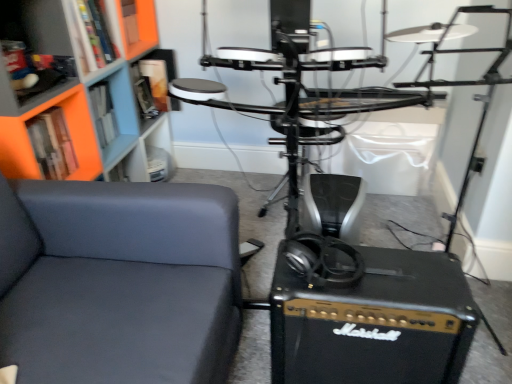
Question: Can you confirm if matte gray chair at left is thinner than orange matte bookshelf at upper left, which ranks as the 1th shelf in top-to-bottom order?

Choices:
 (A) no
 (B) yes

Answer: (A)

Question: Considering the relative sizes of matte gray chair at left and orange matte bookshelf at upper left, which ranks as the 1th shelf in top-to-bottom order, in the image provided, is matte gray chair at left smaller than orange matte bookshelf at upper left, which ranks as the 1th shelf in top-to-bottom order,?

Choices:
 (A) yes
 (B) no

Answer: (B)

Question: Is matte gray chair at left positioned behind orange matte bookshelf at upper left, which is the third shelf from bottom to top?

Choices:
 (A) yes
 (B) no

Answer: (B)

Question: From the image's perspective, is matte gray chair at left under orange matte bookshelf at upper left, which is the third shelf from bottom to top?

Choices:
 (A) yes
 (B) no

Answer: (A)

Question: Can you confirm if matte gray chair at left is bigger than orange matte bookshelf at upper left, which ranks as the 1th shelf in top-to-bottom order?

Choices:
 (A) no
 (B) yes

Answer: (B)

Question: Is matte gray chair at left wider than orange matte bookshelf at upper left, which ranks as the 1th shelf in top-to-bottom order?

Choices:
 (A) yes
 (B) no

Answer: (A)

Question: Does orange matte bookshelf at upper left, which is the third shelf from bottom to top, turn towards matte gray chair at left?

Choices:
 (A) no
 (B) yes

Answer: (A)

Question: Is the position of orange matte bookshelf at upper left, which ranks as the 1th shelf in top-to-bottom order, less distant than that of matte gray chair at left?

Choices:
 (A) no
 (B) yes

Answer: (A)

Question: Is orange matte bookshelf at upper left, which ranks as the 1th shelf in top-to-bottom order, looking in the opposite direction of matte gray chair at left?

Choices:
 (A) yes
 (B) no

Answer: (B)

Question: Does orange matte bookshelf at upper left, which ranks as the 1th shelf in top-to-bottom order, have a lesser height compared to matte gray chair at left?

Choices:
 (A) no
 (B) yes

Answer: (B)

Question: Are orange matte bookshelf at upper left, which is the third shelf from bottom to top, and matte gray chair at left far apart?

Choices:
 (A) no
 (B) yes

Answer: (A)

Question: Is orange matte bookshelf at upper left, which is the third shelf from bottom to top, taller than matte gray chair at left?

Choices:
 (A) yes
 (B) no

Answer: (B)

Question: Is orange matte bookshelf at upper left, which is the third shelf from bottom to top, located within orange matte bookshelf at upper left, which is the third shelf in top-to-bottom order?

Choices:
 (A) yes
 (B) no

Answer: (B)